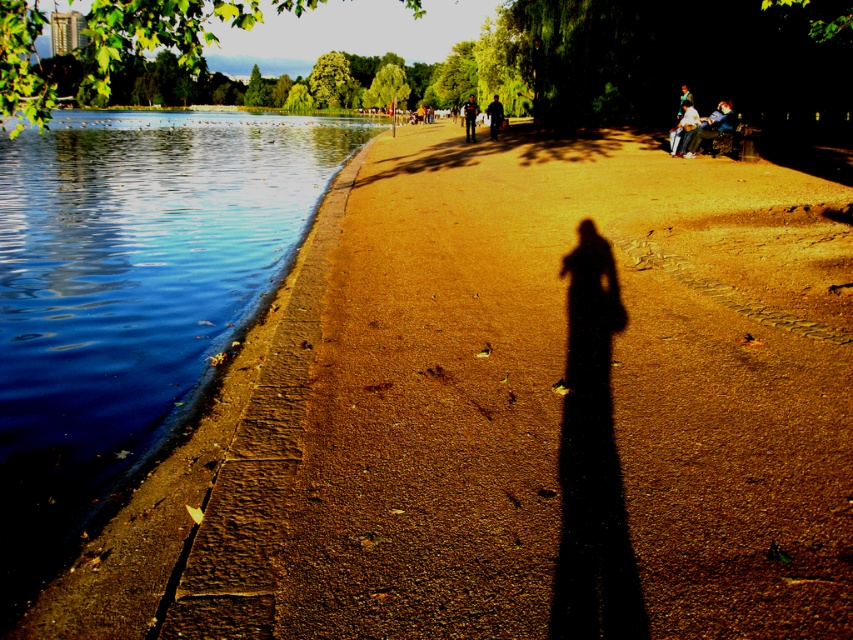
Between blue smooth water at left and dark brown leather jacket at center, which one appears on the right side from the viewer's perspective?

Positioned to the right is dark brown leather jacket at center.

Can you confirm if blue smooth water at left is taller than dark brown leather jacket at center?

Yes, blue smooth water at left is taller than dark brown leather jacket at center.

What do you see at coordinates (131, 294) in the screenshot?
I see `blue smooth water at left` at bounding box center [131, 294].

At what (x,y) coordinates should I click in order to perform the action: click on blue smooth water at left. Please return your answer as a coordinate pair (x, y). Looking at the image, I should click on (131, 294).

Is point (30, 436) positioned before point (686, 145)?

That is True.

Between blue smooth water at left and white cotton shirt at upper right, which one has more height?

With more height is blue smooth water at left.

The image size is (853, 640). I want to click on blue smooth water at left, so click(131, 294).

Locate an element on the screen. blue denim jeans at upper right is located at coordinates (711, 125).

Between blue denim jeans at upper right and white cotton shirt at upper right, which one has more height?

white cotton shirt at upper right is taller.

Between point (706, 120) and point (697, 115), which one is positioned behind?

The point (706, 120) is more distant.

You are a GUI agent. You are given a task and a screenshot of the screen. Output one action in this format:
    pyautogui.click(x=<x>, y=<y>)
    Task: Click on the blue denim jeans at upper right
    The width and height of the screenshot is (853, 640).
    Given the screenshot: What is the action you would take?
    pyautogui.click(x=711, y=125)